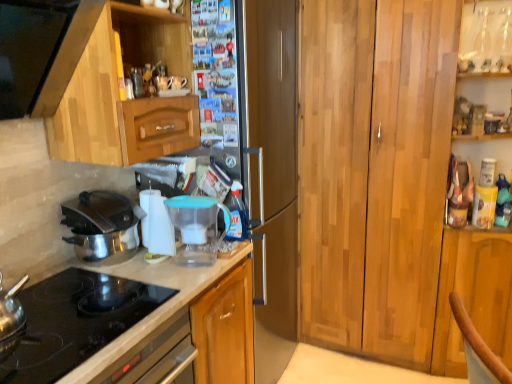
The height and width of the screenshot is (384, 512). In order to click on transparent plastic water filter pitcher at center, the 1th appliance viewed from the right in this screenshot , I will do `click(197, 228)`.

The height and width of the screenshot is (384, 512). I want to click on wooden cabinet at right, the 2th cabinetry from the left, so click(374, 172).

The width and height of the screenshot is (512, 384). What do you see at coordinates (264, 161) in the screenshot? I see `satin silver refrigerator at center` at bounding box center [264, 161].

Image resolution: width=512 pixels, height=384 pixels. What are the coordinates of `polished stainless steel pot at left` in the screenshot? It's located at (101, 224).

Where is `white plastic water filter at center, the first appliance viewed from the left`? Image resolution: width=512 pixels, height=384 pixels. white plastic water filter at center, the first appliance viewed from the left is located at coordinates (157, 225).

Is white plastic water filter at center, the first appliance viewed from the left, touching satin silver refrigerator at center?

white plastic water filter at center, the first appliance viewed from the left, is not next to satin silver refrigerator at center, and they're not touching.

Which of these two, white plastic water filter at center, which is counted as the 2th appliance, starting from the right, or satin silver refrigerator at center, is wider?

satin silver refrigerator at center is wider.

Considering the positions of objects white plastic water filter at center, the first appliance viewed from the left, and satin silver refrigerator at center in the image provided, who is more to the right, white plastic water filter at center, the first appliance viewed from the left, or satin silver refrigerator at center?

satin silver refrigerator at center.

Looking at this image, is transparent plastic bottle at center positioned far away from wooden cabinet at right, the 2th cabinetry from the left?

No.

Can you confirm if transparent plastic bottle at center is bigger than wooden cabinet at right, the 2th cabinetry from the left?

No, transparent plastic bottle at center is not bigger than wooden cabinet at right, the 2th cabinetry from the left.

From a real-world perspective, between transparent plastic bottle at center and wooden cabinet at right, which ranks as the first cabinetry in right-to-left order, who is vertically higher?

transparent plastic bottle at center is physically above.

From a real-world perspective, relative to transparent plastic bottle at center, is satin silver refrigerator at center vertically above or below?

From a real-world perspective, satin silver refrigerator at center is physically below transparent plastic bottle at center.

The height and width of the screenshot is (384, 512). What are the coordinates of `fridge that appears on the left of transparent plastic bottle at center` in the screenshot? It's located at (264, 161).

Considering the sizes of satin silver refrigerator at center and transparent plastic bottle at center in the image, is satin silver refrigerator at center taller or shorter than transparent plastic bottle at center?

In the image, satin silver refrigerator at center appears to be taller than transparent plastic bottle at center.

Considering the relative sizes of satin silver refrigerator at center and transparent plastic bottle at center in the image provided, is satin silver refrigerator at center bigger than transparent plastic bottle at center?

Indeed, satin silver refrigerator at center has a larger size compared to transparent plastic bottle at center.

Is point (163, 231) closer to viewer compared to point (234, 316)?

Yes.

Between white plastic water filter at center, which is counted as the 2th appliance, starting from the right, and white glossy countertop at lower left, which one has smaller width?

white plastic water filter at center, which is counted as the 2th appliance, starting from the right, is thinner.

In the scene shown: Between white plastic water filter at center, which is counted as the 2th appliance, starting from the right, and white glossy countertop at lower left, which one appears on the left side from the viewer's perspective?

white glossy countertop at lower left is more to the left.

From a real-world perspective, is white plastic water filter at center, which is counted as the 2th appliance, starting from the right, above or below white glossy countertop at lower left?

In terms of real-world spatial position, white plastic water filter at center, which is counted as the 2th appliance, starting from the right, is above white glossy countertop at lower left.

Which point is more distant from viewer, (118, 234) or (237, 223)?

The point (237, 223) is more distant.

In the image, is polished stainless steel pot at left positioned in front of or behind transparent plastic bottle at center?

Clearly, polished stainless steel pot at left is in front of transparent plastic bottle at center.

In the scene shown: Considering the relative sizes of polished stainless steel pot at left and transparent plastic bottle at center in the image provided, is polished stainless steel pot at left bigger than transparent plastic bottle at center?

Correct, polished stainless steel pot at left is larger in size than transparent plastic bottle at center.

How many degrees apart are the facing directions of polished stainless steel pot at left and transparent plastic bottle at center?

They differ by 3.61 degrees in their facing directions.

How different are the orientations of transparent plastic bottle at center and polished stainless steel pot at left in degrees?

The facing directions of transparent plastic bottle at center and polished stainless steel pot at left are 3.61 degrees apart.

Which is further, (239, 236) or (125, 215)?

The point (239, 236) is more distant.

In the scene shown: How much distance is there between transparent plastic bottle at center and polished stainless steel pot at left?

The distance of transparent plastic bottle at center from polished stainless steel pot at left is 19.01 inches.

Can you confirm if transparent plastic bottle at center is taller than polished stainless steel pot at left?

No.

Would you say transparent plastic bottle at center contains white plastic water filter at center, which is counted as the 2th appliance, starting from the right?

No, white plastic water filter at center, which is counted as the 2th appliance, starting from the right, is not a part of transparent plastic bottle at center.

Can you confirm if transparent plastic bottle at center is taller than white plastic water filter at center, the first appliance viewed from the left?

Correct, transparent plastic bottle at center is much taller as white plastic water filter at center, the first appliance viewed from the left.

You are a GUI agent. You are given a task and a screenshot of the screen. Output one action in this format:
    pyautogui.click(x=<x>, y=<y>)
    Task: Click on the 2nd appliance to the left when counting from the transparent plastic bottle at center
    
    Given the screenshot: What is the action you would take?
    pyautogui.click(x=157, y=225)

From the satin silver refrigerator at center, count the 2nd appliance to the left and point to it. Please provide its 2D coordinates.

[(157, 225)]

Identify the location of bottle behind the wooden cabinet at right, the 2th cabinetry from the left. (237, 215).

Estimate the real-world distances between objects in this image. Which object is closer to satin silver refrigerator at center, polished stainless steel pot at left or white plastic water filter at center, the first appliance viewed from the left?

white plastic water filter at center, the first appliance viewed from the left, is closer to satin silver refrigerator at center.

Looking at the image, which one is located closer to wooden cabinet at right, the 2th cabinetry from the left, transparent plastic bottle at center or white glossy countertop at lower left?

transparent plastic bottle at center is closer to wooden cabinet at right, the 2th cabinetry from the left.

Looking at the image, which one is located closer to transparent plastic bottle at center, white plastic water filter at center, which is counted as the 2th appliance, starting from the right, or white glossy countertop at lower left?

white plastic water filter at center, which is counted as the 2th appliance, starting from the right, lies closer to transparent plastic bottle at center than the other object.

From the image, which object appears to be farther from transparent plastic water filter pitcher at center, which is counted as the 2th appliance, starting from the left, white plastic water filter at center, which is counted as the 2th appliance, starting from the right, or transparent plastic bottle at center?

transparent plastic bottle at center is positioned further to the anchor transparent plastic water filter pitcher at center, which is counted as the 2th appliance, starting from the left.

Estimate the real-world distances between objects in this image. Which object is closer to white plastic water filter at center, the first appliance viewed from the left, wooden cabinet at left, which is counted as the 2th cabinetry, starting from the right, or transparent plastic bottle at center?

Based on the image, transparent plastic bottle at center appears to be nearer to white plastic water filter at center, the first appliance viewed from the left.

Considering their positions, is satin silver refrigerator at center positioned closer to wooden cabinet at right, which ranks as the first cabinetry in right-to-left order, than transparent plastic bottle at center?

The object closer to wooden cabinet at right, which ranks as the first cabinetry in right-to-left order, is satin silver refrigerator at center.

Considering their positions, is white plastic water filter at center, the first appliance viewed from the left, positioned further to wooden cabinet at right, which ranks as the first cabinetry in right-to-left order, than wooden cabinet at left, which is counted as the 2th cabinetry, starting from the right?

Among the two, white plastic water filter at center, the first appliance viewed from the left, is located further to wooden cabinet at right, which ranks as the first cabinetry in right-to-left order.

Estimate the real-world distances between objects in this image. Which object is closer to polished stainless steel pot at left, transparent plastic water filter pitcher at center, which is counted as the 2th appliance, starting from the left, or white plastic water filter at center, the first appliance viewed from the left?

white plastic water filter at center, the first appliance viewed from the left, is closer to polished stainless steel pot at left.

I want to click on kitchen appliance between wooden cabinet at left, which is counted as the 2th cabinetry, starting from the right, and transparent plastic water filter pitcher at center, the 1th appliance viewed from the right, from top to bottom, so pyautogui.click(x=101, y=224).

Where is `appliance between wooden cabinet at left, which is counted as the 2th cabinetry, starting from the right, and transparent plastic water filter pitcher at center, the 1th appliance viewed from the right, from top to bottom`? This screenshot has height=384, width=512. appliance between wooden cabinet at left, which is counted as the 2th cabinetry, starting from the right, and transparent plastic water filter pitcher at center, the 1th appliance viewed from the right, from top to bottom is located at coordinates (157, 225).

I want to click on appliance that lies between polished stainless steel pot at left and white glossy countertop at lower left from top to bottom, so click(x=197, y=228).

Find the location of a particular element. The height and width of the screenshot is (384, 512). fridge situated between white glossy countertop at lower left and wooden cabinet at right, which ranks as the first cabinetry in right-to-left order, from left to right is located at coordinates (264, 161).